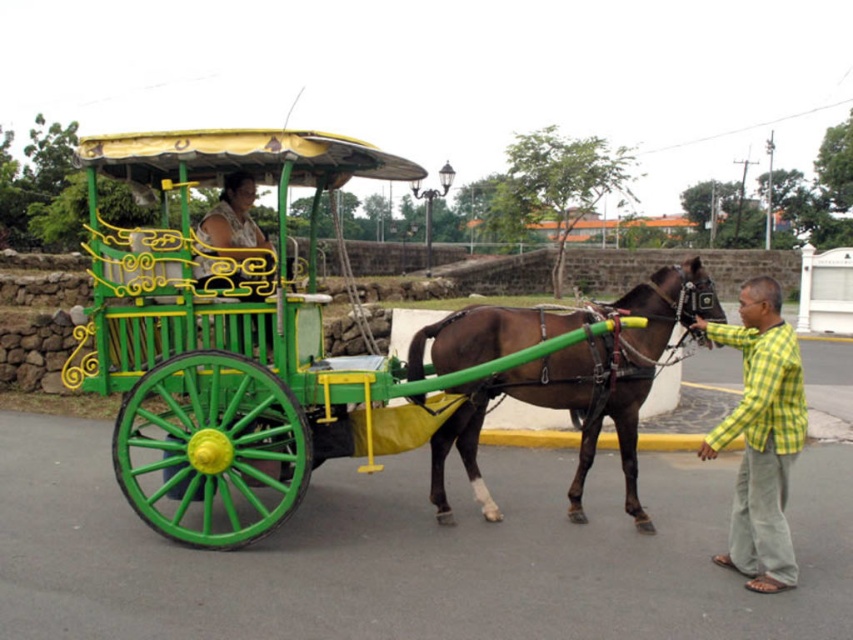
Which is in front, point (532, 355) or point (671, 272)?

Point (532, 355) is in front.

Which is above, green polished wood horse cart at center or brown glossy horse at center?

Positioned higher is green polished wood horse cart at center.

In order to click on green polished wood horse cart at center in this screenshot , I will do `click(316, 348)`.

Is brown glossy horse at center smaller than yellow-green checkered shirt at lower right?

No.

Find the location of a particular element. This screenshot has width=853, height=640. brown glossy horse at center is located at coordinates tap(583, 388).

Is point (584, 349) positioned in front of point (779, 465)?

No, (584, 349) is behind (779, 465).

Locate an element on the screen. brown glossy horse at center is located at coordinates pos(583,388).

Is green polished wood horse cart at center positioned in front of yellow-green checkered shirt at lower right?

No, green polished wood horse cart at center is further to the viewer.

Who is positioned more to the right, green polished wood horse cart at center or yellow-green checkered shirt at lower right?

From the viewer's perspective, yellow-green checkered shirt at lower right appears more on the right side.

What are the coordinates of `green polished wood horse cart at center` in the screenshot? It's located at (316, 348).